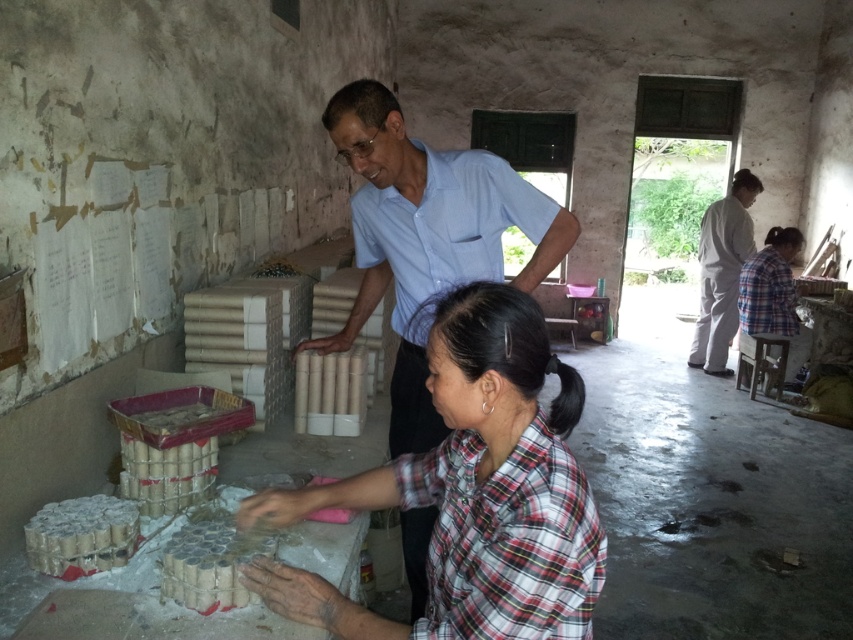
Question: Does plaid fabric shirt at center appear on the left side of plaid fabric shirt at lower right?

Choices:
 (A) yes
 (B) no

Answer: (A)

Question: Is plaid fabric shirt at lower right thinner than black silky hair at center?

Choices:
 (A) yes
 (B) no

Answer: (B)

Question: Is plaid fabric shirt at lower right thinner than black silky hair at center?

Choices:
 (A) yes
 (B) no

Answer: (B)

Question: Which point is farther to the camera?

Choices:
 (A) light blue cotton shirt at upper center
 (B) plaid fabric shirt at lower right

Answer: (B)

Question: Which point is farther to the camera?

Choices:
 (A) plaid fabric shirt at center
 (B) black silky hair at center

Answer: (B)

Question: Among these points, which one is nearest to the camera?

Choices:
 (A) (712, 332)
 (B) (360, 196)
 (C) (766, 273)
 (D) (573, 408)

Answer: (D)